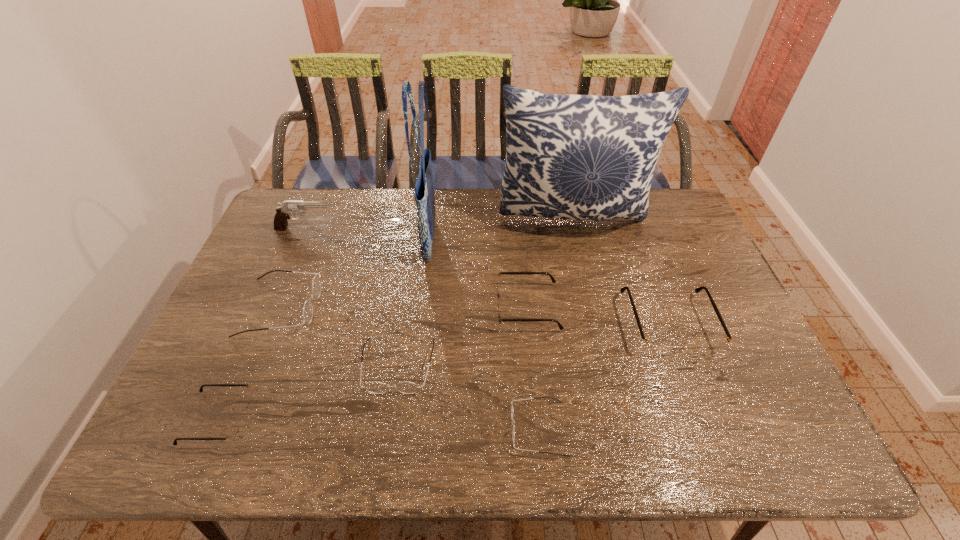
Locate which object is the eighth closest to the second smallest black spectacles. Please provide its 2D coordinates. Your answer should be formatted as a tuple, i.e. [(x, y)], where the tuple contains the x and y coordinates of a point satisfying the conditions above.

[(233, 432)]

Identify which object is the fourth nearest to the second black spectacles from right to left. Please provide its 2D coordinates. Your answer should be formatted as a tuple, i.e. [(x, y)], where the tuple contains the x and y coordinates of a point satisfying the conditions above.

[(424, 190)]

Identify the location of spectacles that stands as the second closest to the nearest black spectacles. This screenshot has height=540, width=960. (374, 387).

Choose which spectacles is the third nearest neighbor to the second black spectacles from right to left. Please provide its 2D coordinates. Your answer should be formatted as a tuple, i.e. [(x, y)], where the tuple contains the x and y coordinates of a point satisfying the conditions above.

[(537, 397)]

Identify the location of black spectacles object that ranks as the second closest to the smallest black spectacles. (657, 346).

The image size is (960, 540). I want to click on black spectacles that is the closest to the rightmost dark spectacles, so click(x=498, y=297).

You are a GUI agent. You are given a task and a screenshot of the screen. Output one action in this format:
    pyautogui.click(x=<x>, y=<y>)
    Task: Click on the closest dark spectacles to the gun
    The image size is (960, 540).
    Given the screenshot: What is the action you would take?
    pyautogui.click(x=316, y=284)

Find the location of a particular element. dark spectacles that is the closest one to the rightmost dark spectacles is located at coordinates (374, 387).

Locate an element on the screen. free space that satisfies the following two spatial constraints: 1. on the front surface of the blue cushion; 2. at the hinge ends of the second black spectacles from right to left is located at coordinates (594, 307).

The width and height of the screenshot is (960, 540). In order to click on vacant space that satisfies the following two spatial constraints: 1. at the hinge ends of the rightmost spectacles; 2. at the hinge ends of the nearest black spectacles in this screenshot , I will do `click(704, 419)`.